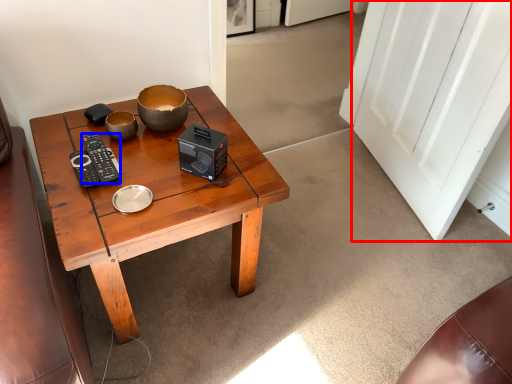
Question: Among these objects, which one is farthest to the camera, door (highlighted by a red box) or control (highlighted by a blue box)?

Choices:
 (A) door
 (B) control

Answer: (B)